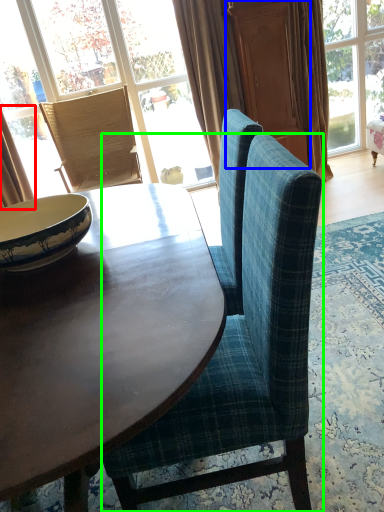
Question: Considering the real-world distances, which object is farthest from curtain (highlighted by a red box)? screen door (highlighted by a blue box) or chair (highlighted by a green box)?

Choices:
 (A) screen door
 (B) chair

Answer: (B)